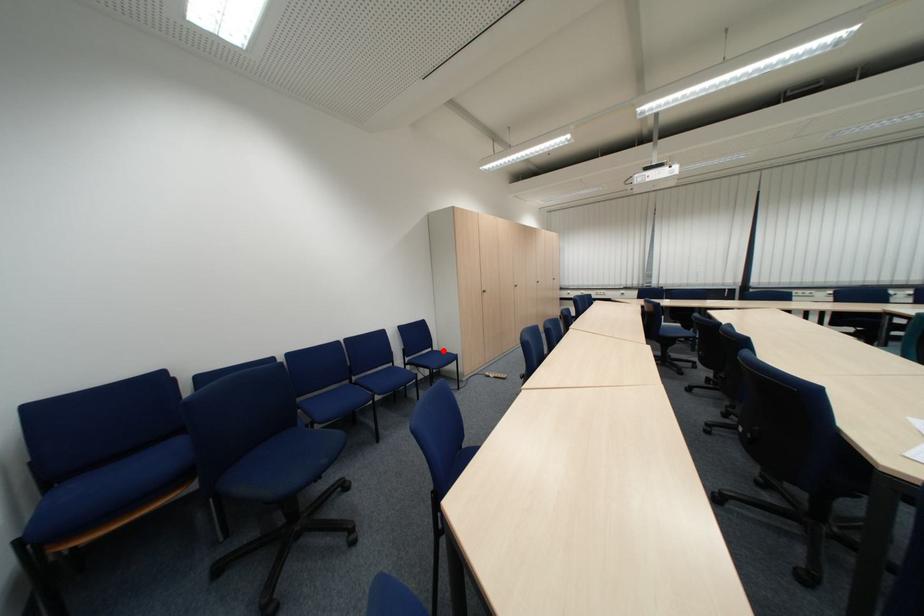
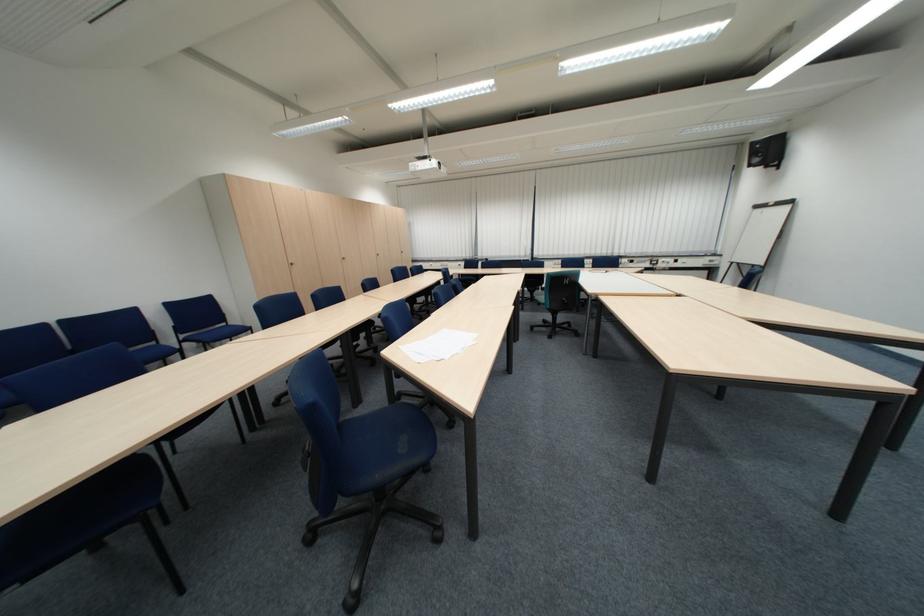
Question: A red point is marked in image1. In image2, is the corresponding 3D point closer to the camera or farther? Reply with the corresponding letter.

Choices:
 (A) The corresponding 3D point is closer.
 (B) The corresponding 3D point is farther.

Answer: (B)